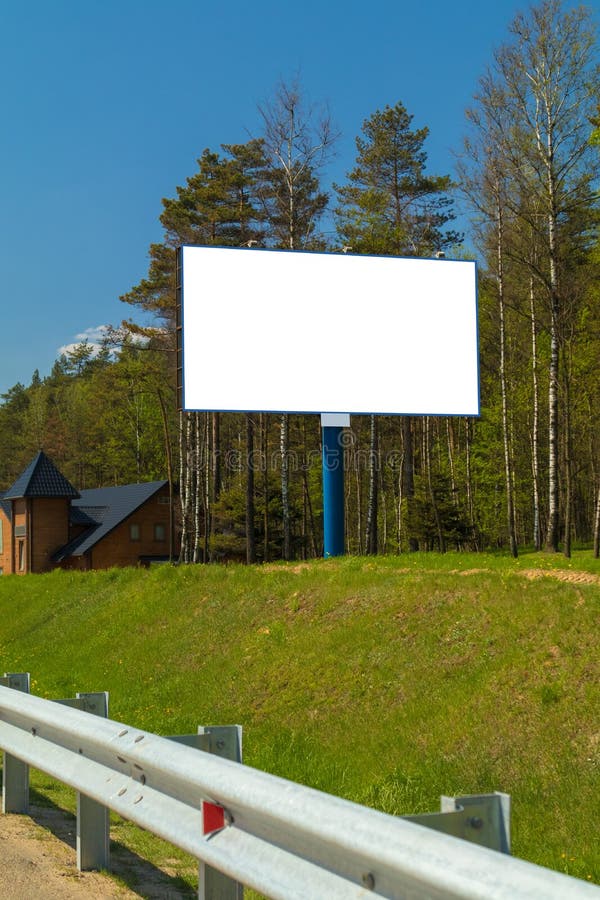
Identify the location of blue pillar. The width and height of the screenshot is (600, 900). (331, 470).